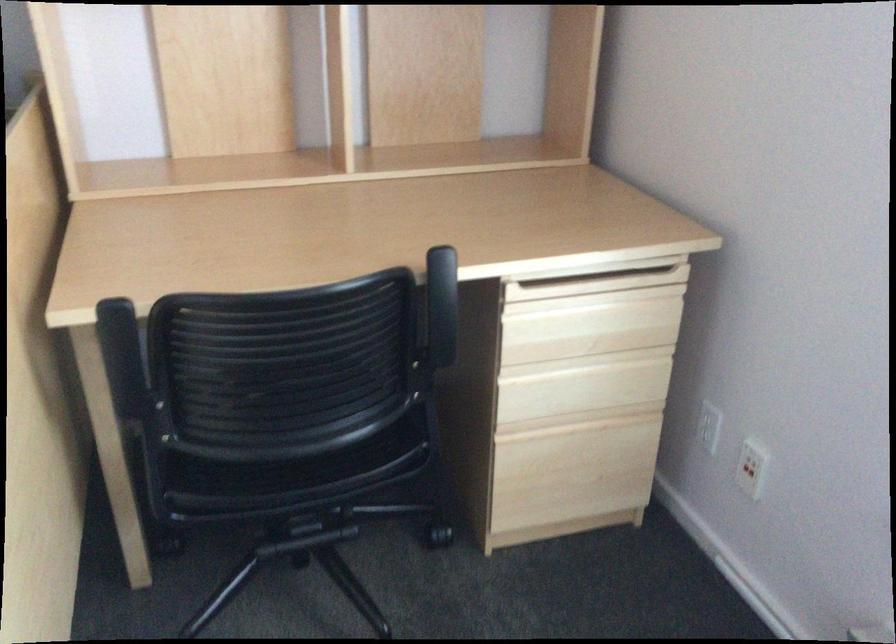
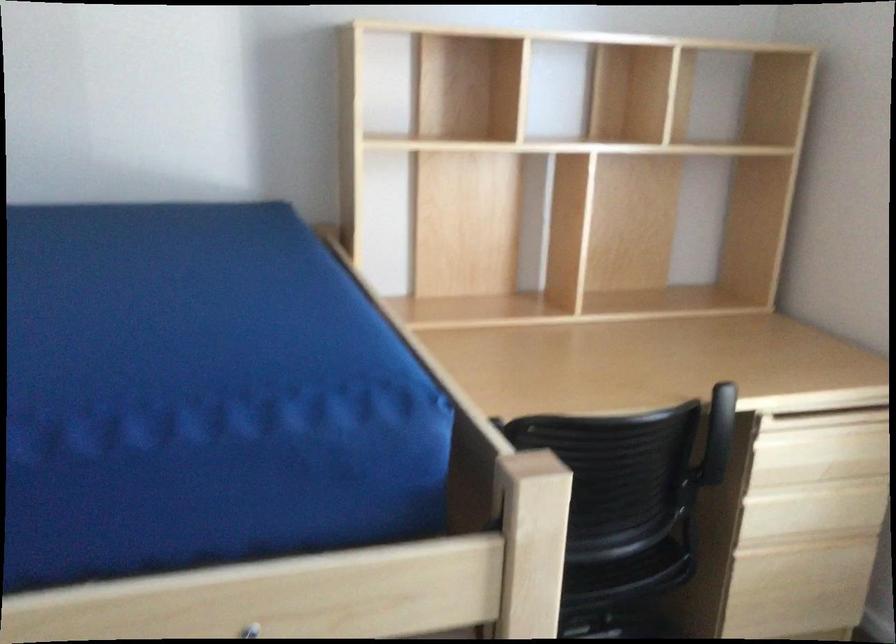
Question: How did the camera likely rotate?

Choices:
 (A) Left
 (B) Right
 (C) Up
 (D) Down

Answer: (C)